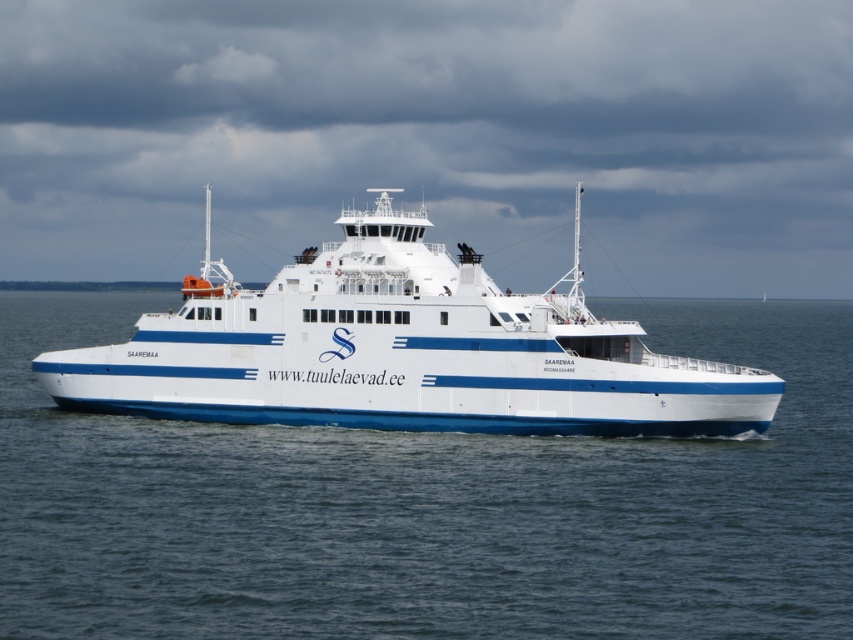
Question: Which point is closer to the camera taking this photo?

Choices:
 (A) (357, 216)
 (B) (688, 493)

Answer: (B)

Question: Which point is closer to the camera taking this photo?

Choices:
 (A) (581, 340)
 (B) (802, 451)

Answer: (B)

Question: From the image, what is the correct spatial relationship of blue water at center in relation to white matte ferry at center?

Choices:
 (A) right
 (B) left

Answer: (A)

Question: Does blue water at center have a larger size compared to white matte ferry at center?

Choices:
 (A) no
 (B) yes

Answer: (B)

Question: In this image, where is blue water at center located relative to white matte ferry at center?

Choices:
 (A) right
 (B) left

Answer: (A)